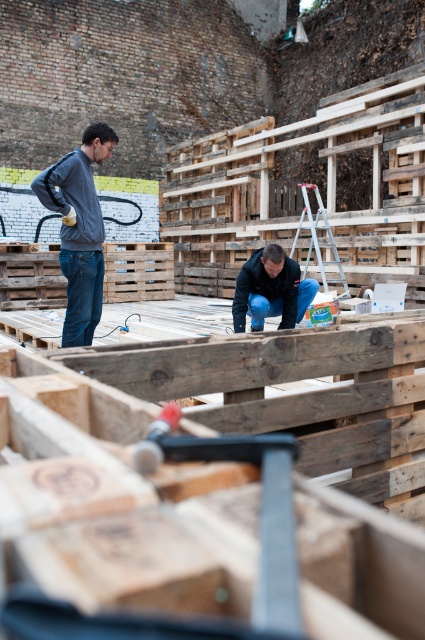
You are observing two workers in the construction scene. One is wearing a matte gray hoodie at left, and the other has a dark blue fabric at center draped over their shoulders. From your perspective, which clothing item is positioned more to the left?

The matte gray hoodie at left is positioned more to the left compared to the dark blue fabric at center.

You are an observer standing in front of the construction site. You notice a black rubber hammer at center and a matte gray hoodie at left. Which object is shorter in height?

The black rubber hammer at center is shorter in height compared to the matte gray hoodie at left.